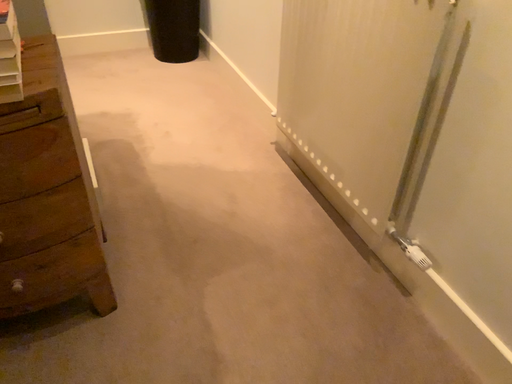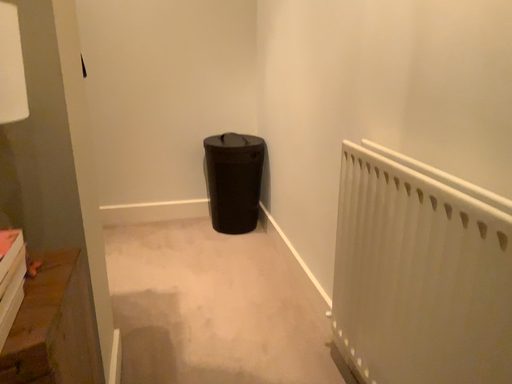
Question: How did the camera likely rotate when shooting the video?

Choices:
 (A) rotated right
 (B) rotated left

Answer: (B)